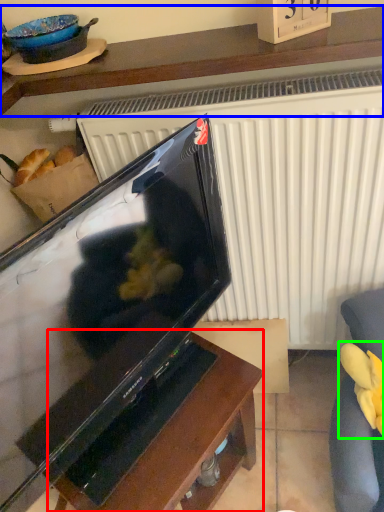
Question: Considering the real-world distances, which object is closest to table (highlighted by a red box)? furniture (highlighted by a blue box) or food (highlighted by a green box).

Choices:
 (A) furniture
 (B) food

Answer: (B)